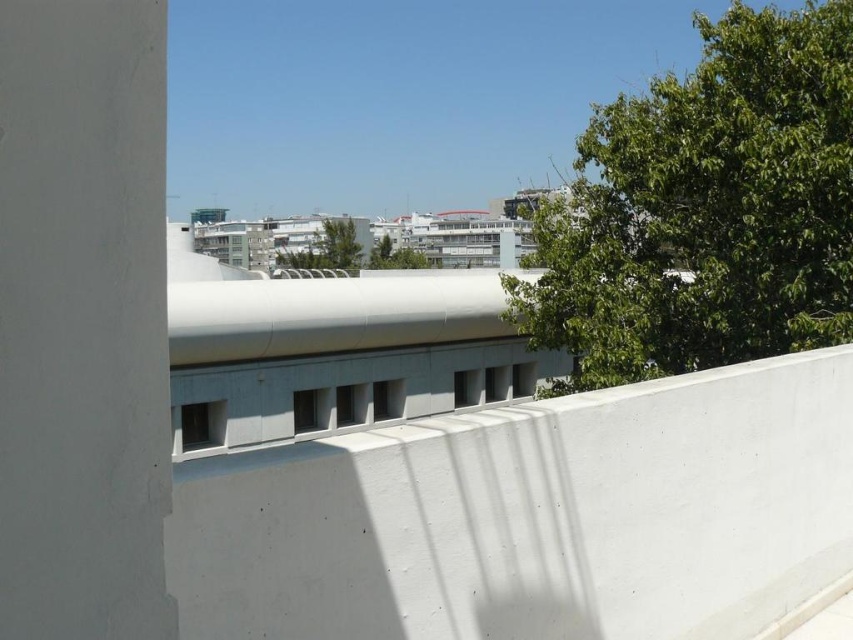
Who is higher up, green leafy tree at upper right or green leafy tree at center?

green leafy tree at upper right

Consider the image. Is green leafy tree at upper right positioned in front of green leafy tree at center?

Yes, green leafy tree at upper right is in front of green leafy tree at center.

At what (x,y) coordinates should I click in order to perform the action: click on green leafy tree at upper right. Please return your answer as a coordinate pair (x, y). This screenshot has width=853, height=640. Looking at the image, I should click on pyautogui.click(x=706, y=209).

The width and height of the screenshot is (853, 640). Find the location of `green leafy tree at upper right`. green leafy tree at upper right is located at coordinates (706, 209).